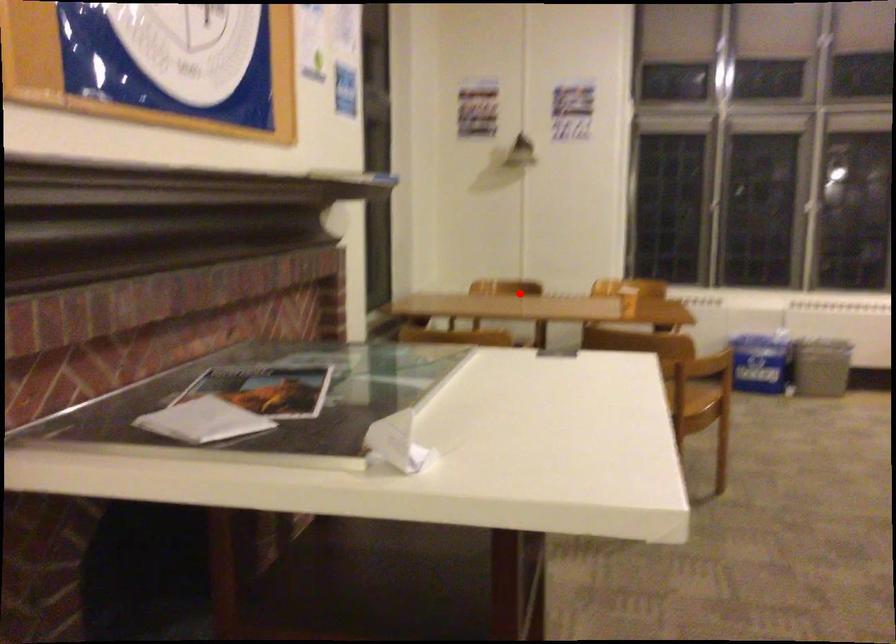
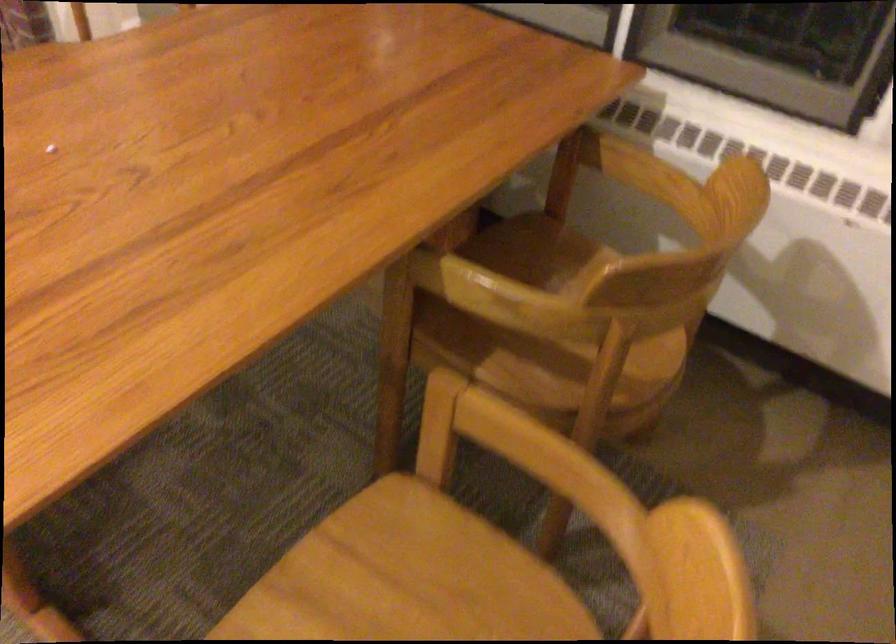
Locate, in the second image, the point that corresponds to the highlighted location in the first image.

(545, 330)